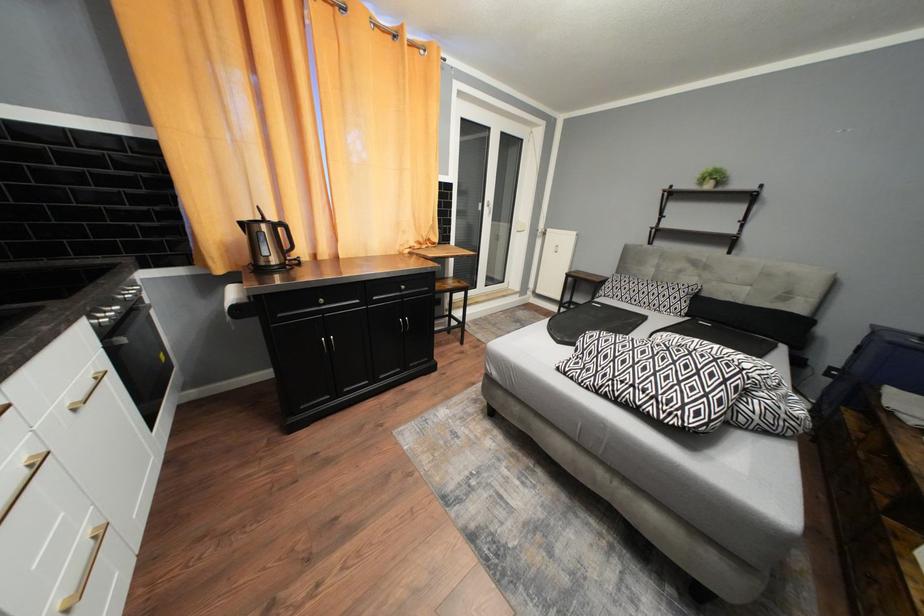
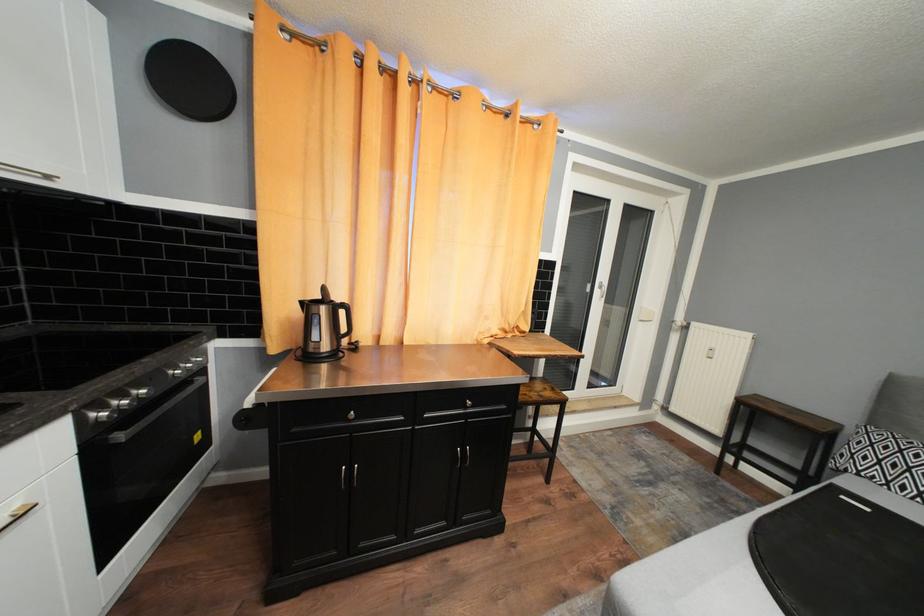
Question: In a continuous first-person perspective shot, in which direction is the camera moving?

Choices:
 (A) Left
 (B) Right
 (C) Forward
 (D) Backward

Answer: (C)